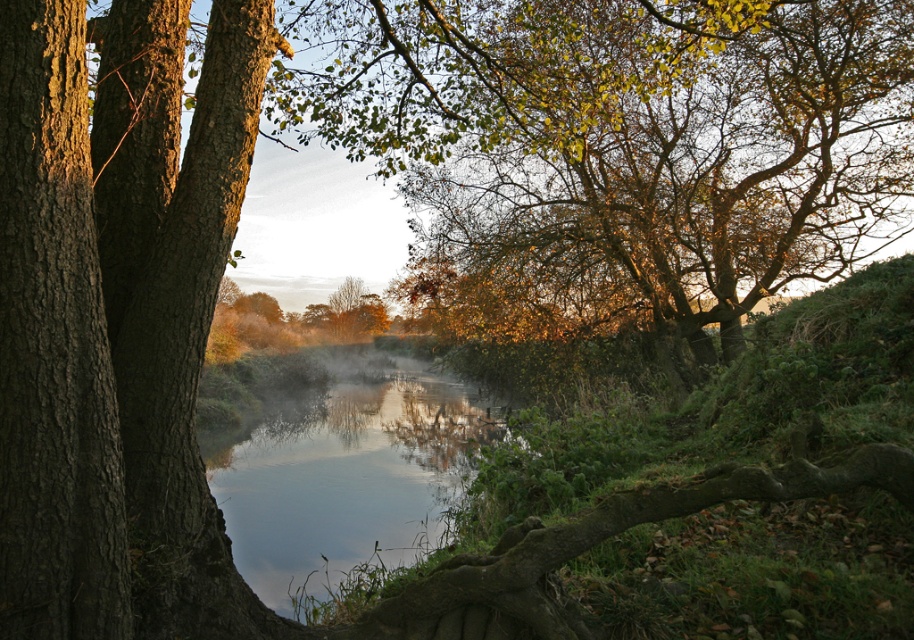
Question: Does golden-brown textured tree at upper right appear under reflective glass water at center?

Choices:
 (A) no
 (B) yes

Answer: (A)

Question: Can you confirm if golden-brown textured tree at upper right is bigger than reflective glass water at center?

Choices:
 (A) no
 (B) yes

Answer: (B)

Question: Among these points, which one is nearest to the camera?

Choices:
 (A) click(441, 525)
 (B) click(533, 163)

Answer: (A)

Question: Which of the following is the closest to the observer?

Choices:
 (A) reflective glass water at center
 (B) golden-brown textured tree at upper right

Answer: (A)

Question: Which point is farther to the camera?

Choices:
 (A) (264, 580)
 (B) (553, 282)

Answer: (B)

Question: Is golden-brown textured tree at upper right positioned before reflective glass water at center?

Choices:
 (A) yes
 (B) no

Answer: (B)